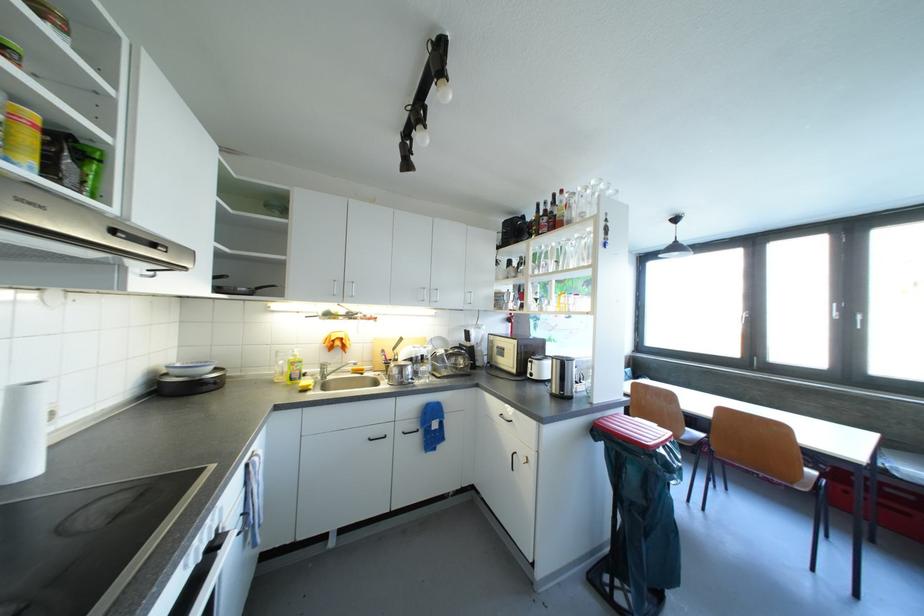
Find the location of a particular element. This screenshot has height=616, width=924. drinking glass is located at coordinates (660, 285).